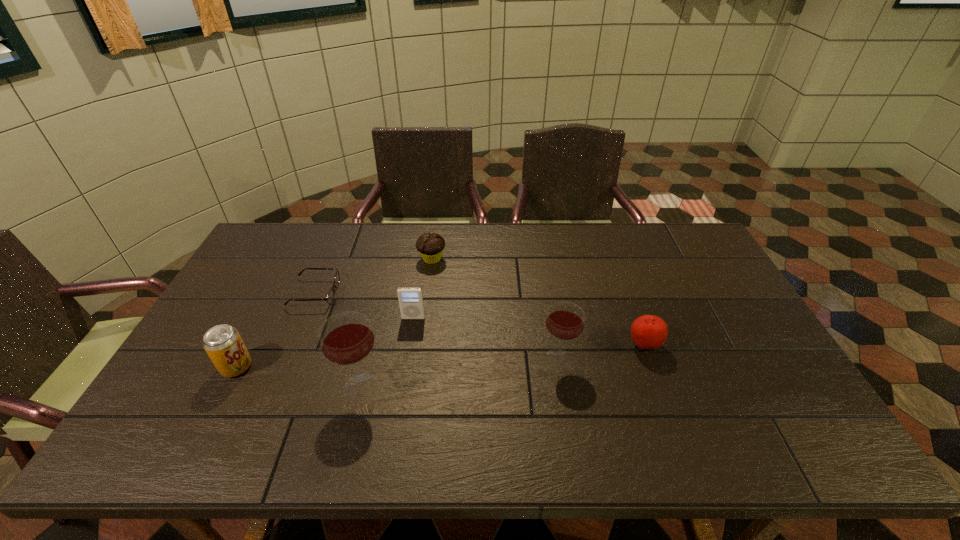
The width and height of the screenshot is (960, 540). What are the coordinates of `free space between the leftmost object and the fifth object from right to left` in the screenshot? It's located at (299, 376).

The image size is (960, 540). I want to click on unoccupied area between the tallest object and the shorter wineglass, so click(460, 373).

Find the location of a particular element. The height and width of the screenshot is (540, 960). free space between the farthest object and the sixth object from left to right is located at coordinates (495, 309).

Identify which object is located as the sixth nearest to the fifth nearest object. Please provide its 2D coordinates. Your answer should be formatted as a tuple, i.e. [(x, y)], where the tuple contains the x and y coordinates of a point satisfying the conditions above.

[(649, 332)]

Image resolution: width=960 pixels, height=540 pixels. I want to click on the sixth closest object relative to the second tallest object, so click(223, 344).

In order to click on vacant area in the image that satisfies the following two spatial constraints: 1. on the back side of the second object from right to left; 2. on the lenses of the sixth nearest object in this screenshot , I will do `click(547, 293)`.

Locate an element on the screen. The image size is (960, 540). vacant area that satisfies the following two spatial constraints: 1. on the back side of the rightmost object; 2. on the right side of the pop (soda) is located at coordinates (248, 345).

Identify the location of free space that satisfies the following two spatial constraints: 1. on the lenses of the second farthest object; 2. on the left side of the taller wineglass. (276, 387).

You are a GUI agent. You are given a task and a screenshot of the screen. Output one action in this format:
    pyautogui.click(x=<x>, y=<y>)
    Task: Click on the free space that satisfies the following two spatial constraints: 1. on the lenses of the sixth shortest object; 2. on the left side of the second object from left to right
    Image resolution: width=960 pixels, height=540 pixels.
    Given the screenshot: What is the action you would take?
    pyautogui.click(x=287, y=359)

This screenshot has height=540, width=960. Identify the location of vacant area in the image that satisfies the following two spatial constraints: 1. on the front-facing side of the rightmost object; 2. on the left side of the iPod. (409, 345).